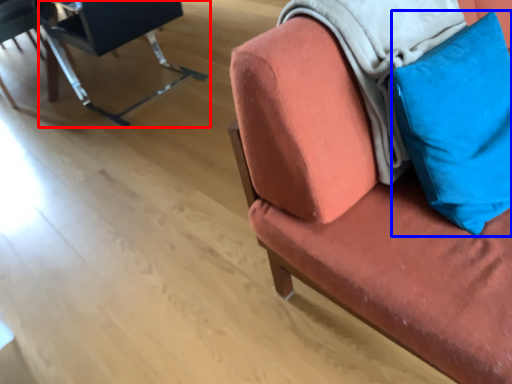
Question: Which point is closer to the camera, chair (highlighted by a red box) or pillow (highlighted by a blue box)?

Choices:
 (A) chair
 (B) pillow

Answer: (B)